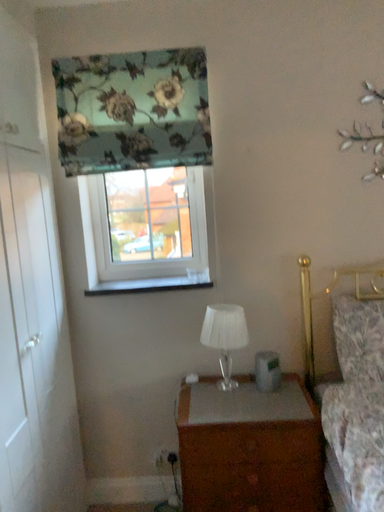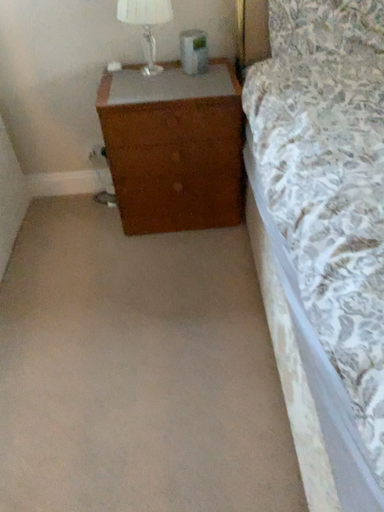
Question: Which way did the camera rotate in the video?

Choices:
 (A) rotated upward
 (B) rotated downward

Answer: (B)